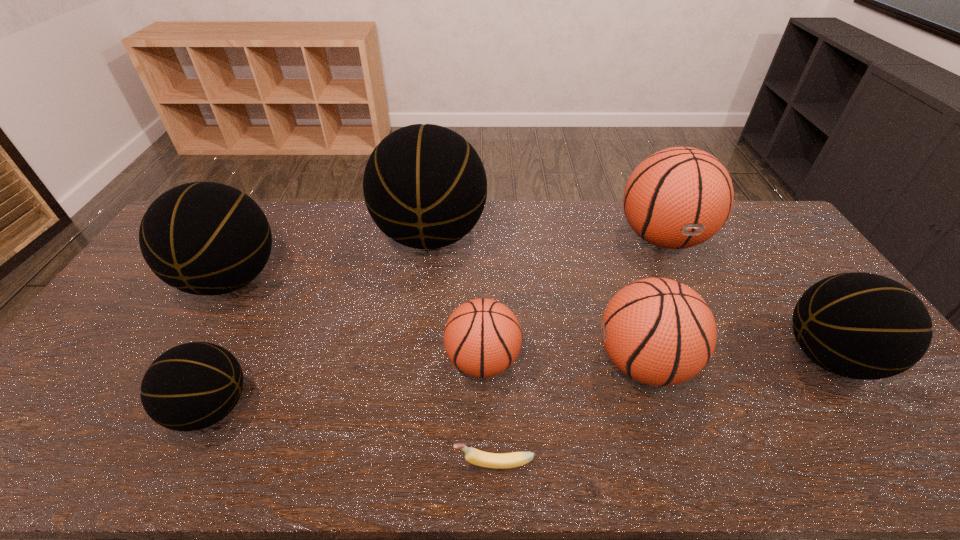
You are a GUI agent. You are given a task and a screenshot of the screen. Output one action in this format:
    pyautogui.click(x=<x>, y=<y>)
    Task: Click on the shortest object
    
    Given the screenshot: What is the action you would take?
    pyautogui.click(x=474, y=456)

Where is `free space located 0.070m on the right of the tallest basketball`? free space located 0.070m on the right of the tallest basketball is located at coordinates (507, 236).

At what (x,y) coordinates should I click in order to perform the action: click on vacant position located 0.340m on the side where the inflation valve is located. Please return your answer as a coordinate pair (x, y). Looking at the image, I should click on (718, 356).

Where is `vacant space located 0.380m on the right of the third smallest black basketball`? vacant space located 0.380m on the right of the third smallest black basketball is located at coordinates tap(402, 279).

You are a GUI agent. You are given a task and a screenshot of the screen. Output one action in this format:
    pyautogui.click(x=<x>, y=<y>)
    Task: Click on the vacant space situated 0.350m on the side where the inflation valve is located
    
    Given the screenshot: What is the action you would take?
    pyautogui.click(x=462, y=363)

Identify the location of vacant area located 0.150m on the side where the inflation valve is located. (538, 363).

You are a GUI agent. You are given a task and a screenshot of the screen. Output one action in this format:
    pyautogui.click(x=<x>, y=<y>)
    Task: Click on the free space located 0.160m on the side where the inflation valve is located
    Image resolution: width=960 pixels, height=540 pixels.
    Given the screenshot: What is the action you would take?
    pyautogui.click(x=534, y=363)

Image resolution: width=960 pixels, height=540 pixels. I want to click on vacant space located 0.260m on the back of the third biggest black basketball, so click(x=762, y=260).

Identify the location of free location located on the side where the inflation valve is located. click(x=416, y=361).

Identify the location of free space located on the side where the inflation valve is located. (356, 361).